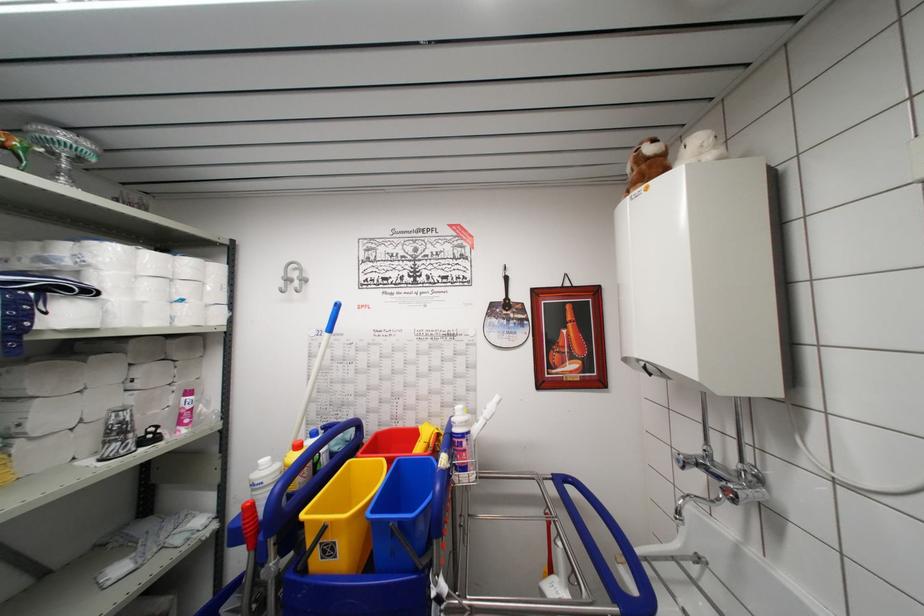
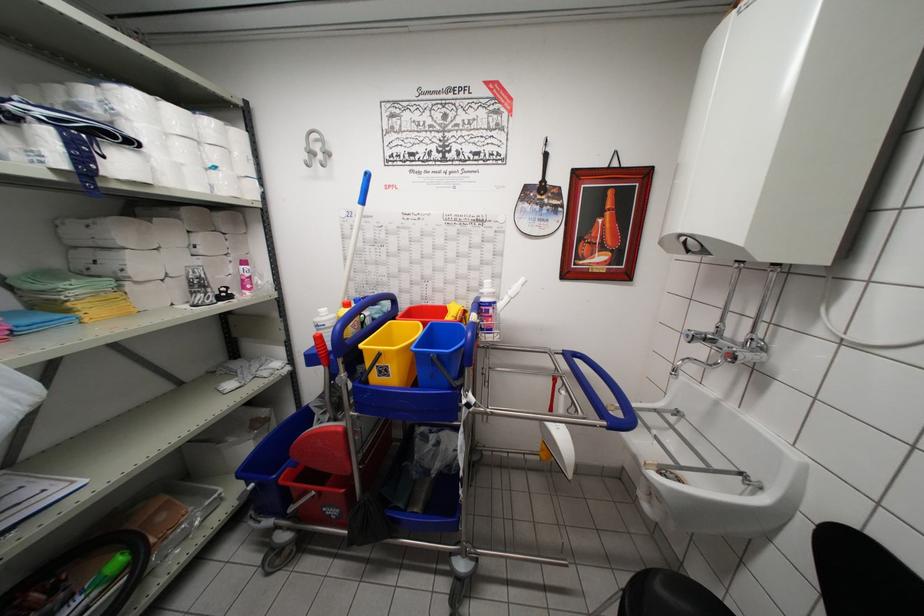
In the scene shown: Which direction would the cameraman need to move to produce the second image?

The cameraman walked toward left, backward.